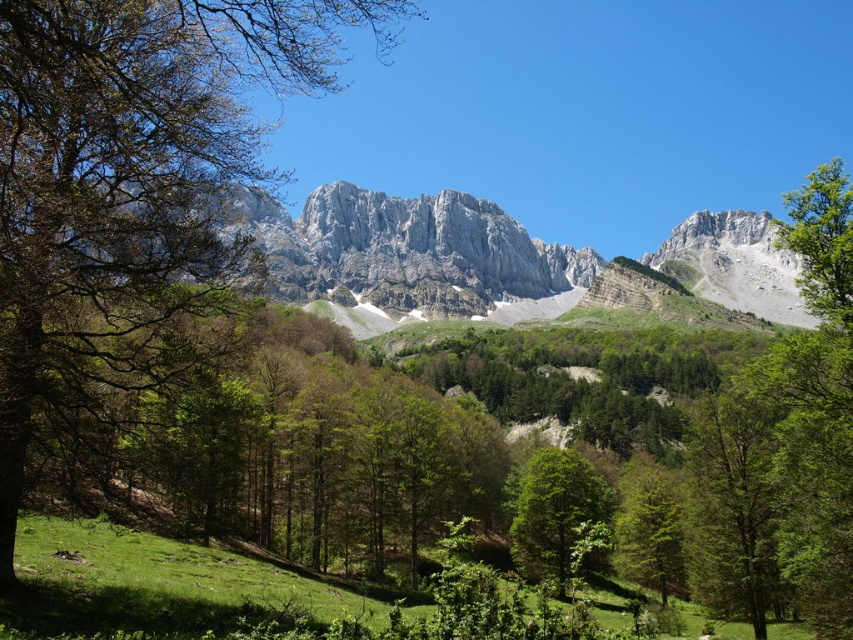
Question: Does green leafy tree at left appear under gray rocky mountain at center?

Choices:
 (A) yes
 (B) no

Answer: (B)

Question: Does gray rocky mountain at center appear on the right side of green leafy tree at center?

Choices:
 (A) no
 (B) yes

Answer: (B)

Question: Which point is farther to the camera?

Choices:
 (A) gray rocky mountain at center
 (B) green leafy tree at left

Answer: (A)

Question: Can you confirm if green leafy tree at left is bigger than green leafy tree at center?

Choices:
 (A) yes
 (B) no

Answer: (A)

Question: Which object appears farthest from the camera in this image?

Choices:
 (A) green leafy tree at lower right
 (B) green leafy tree at center
 (C) green leafy tree at left
 (D) gray rocky mountain at center

Answer: (A)

Question: Which object is farther from the camera taking this photo?

Choices:
 (A) green leafy tree at left
 (B) green leafy tree at center

Answer: (B)